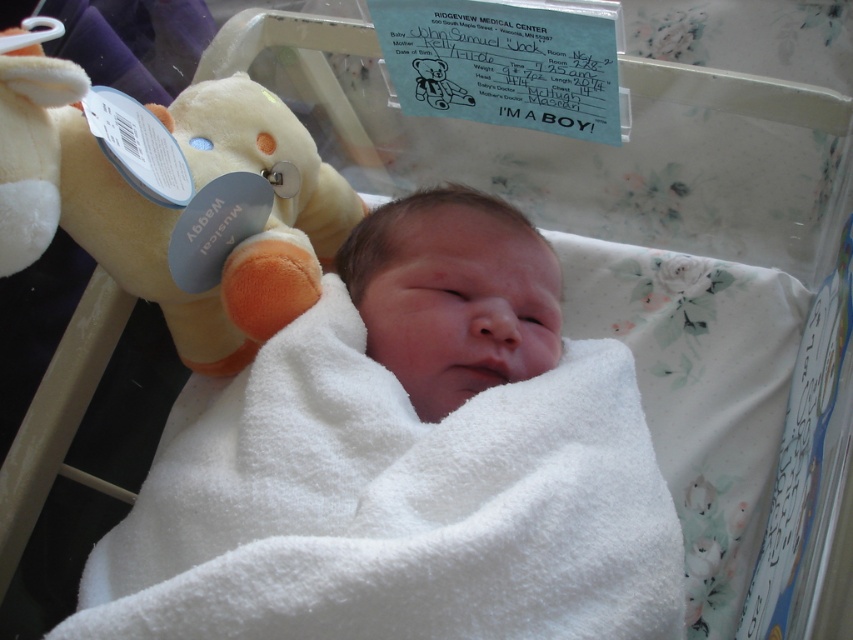
Can you confirm if fluffy white plush bear at left is positioned below white soft blanket at center?

Incorrect, fluffy white plush bear at left is not positioned below white soft blanket at center.

In the scene shown: Does fluffy white plush bear at left come behind white soft blanket at center?

No, fluffy white plush bear at left is closer to the viewer.

Is point (230, 308) closer to viewer compared to point (383, 362)?

No, it is not.

At what (x,y) coordinates should I click in order to perform the action: click on fluffy white plush bear at left. Please return your answer as a coordinate pair (x, y). Image resolution: width=853 pixels, height=640 pixels. Looking at the image, I should click on (170, 209).